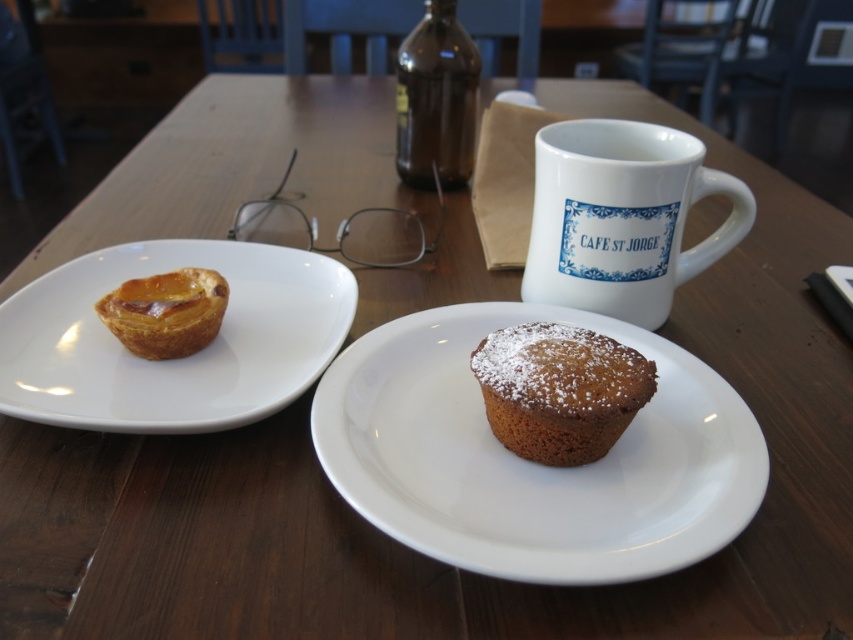
Describe the element at coordinates (622, 218) in the screenshot. The image size is (853, 640). I see `white ceramic mug at upper right` at that location.

Can you confirm if white ceramic mug at upper right is positioned above brown glass bottle at upper center?

Actually, white ceramic mug at upper right is below brown glass bottle at upper center.

Who is more forward, [641,147] or [405,109]?

Point [641,147]

In order to click on white ceramic mug at upper right in this screenshot , I will do `click(622, 218)`.

Does brown matte cupcake at center come in front of white glossy plate at left?

Yes, brown matte cupcake at center is closer to the viewer.

Is brown matte cupcake at center to the right of white glossy plate at left from the viewer's perspective?

Yes, brown matte cupcake at center is to the right of white glossy plate at left.

Identify the location of brown matte cupcake at center. This screenshot has height=640, width=853. (532, 461).

Is brown matte cupcake at center positioned at the back of golden brown flaky pastry at upper left?

No, brown matte cupcake at center is in front of golden brown flaky pastry at upper left.

In the scene shown: Who is more forward, (674, 372) or (120, 284)?

Positioned in front is point (674, 372).

Where is `brown matte cupcake at center`? brown matte cupcake at center is located at coordinates (532, 461).